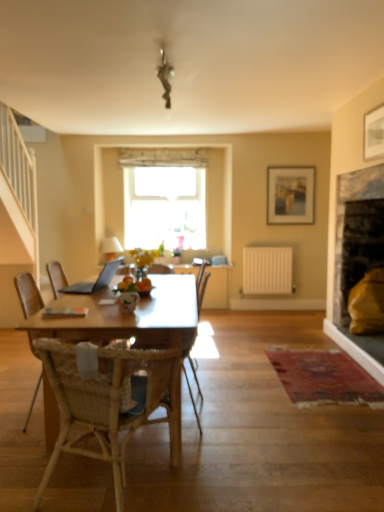
Where is `vacant area situated below woven wood chair at center, which is the 1th chair from front to back (from a real-world perspective)`? The image size is (384, 512). vacant area situated below woven wood chair at center, which is the 1th chair from front to back (from a real-world perspective) is located at coordinates (112, 484).